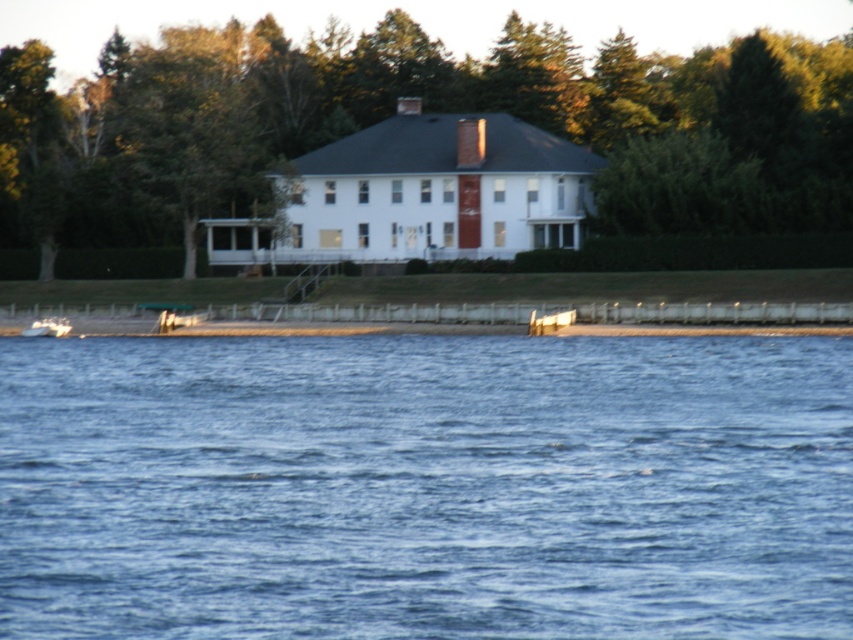
Question: Does green leafy tree at center have a smaller size compared to white matte boat at lower left?

Choices:
 (A) yes
 (B) no

Answer: (B)

Question: Which point appears closest to the camera in this image?

Choices:
 (A) (65, 323)
 (B) (444, 394)

Answer: (B)

Question: Which of the following is the farthest from the observer?

Choices:
 (A) blue liquid water at center
 (B) green leafy tree at center
 (C) white matte boat at lower left

Answer: (B)

Question: Does blue liquid water at center appear on the left side of white matte boat at lower left?

Choices:
 (A) yes
 (B) no

Answer: (B)

Question: Does blue liquid water at center have a larger size compared to white matte boat at lower left?

Choices:
 (A) yes
 (B) no

Answer: (A)

Question: Which point is farther from the camera taking this photo?

Choices:
 (A) (314, 630)
 (B) (38, 330)
 (C) (265, 134)

Answer: (C)